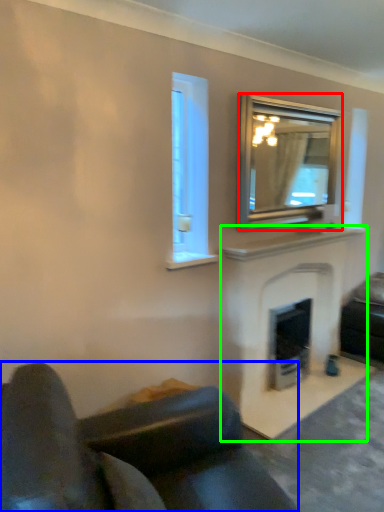
Question: Based on their relative distances, which object is farther from mirror (highlighted by a red box)? Choose from studio couch (highlighted by a blue box) and fireplace (highlighted by a green box).

Choices:
 (A) studio couch
 (B) fireplace

Answer: (A)